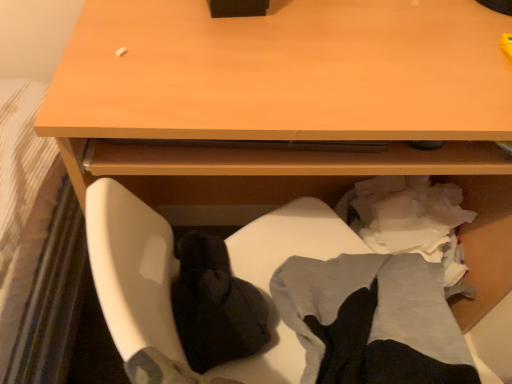
What do you see at coordinates (132, 269) in the screenshot? The image size is (512, 384). I see `black fabric swivel chair at lower left` at bounding box center [132, 269].

The height and width of the screenshot is (384, 512). What are the coordinates of `black fabric swivel chair at lower left` in the screenshot? It's located at (132, 269).

Measure the distance between black fabric swivel chair at lower left and camera.

They are 36.19 centimeters apart.

Locate an element on the screen. This screenshot has height=384, width=512. black fabric swivel chair at lower left is located at coordinates (132, 269).